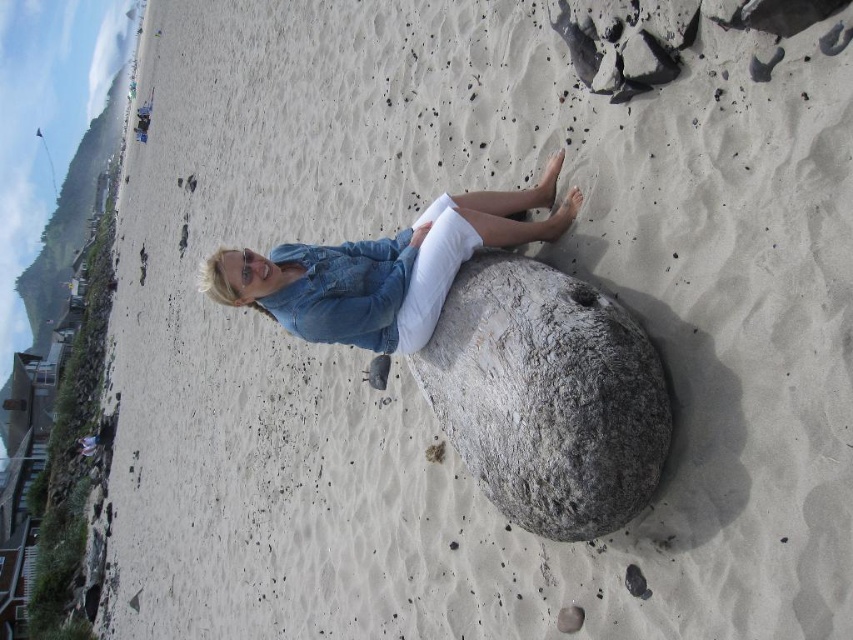
Between point (598, 429) and point (273, 301), which one is positioned in front?

Positioned in front is point (598, 429).

The height and width of the screenshot is (640, 853). In order to click on gray rough boulder at center in this screenshot , I will do `click(547, 396)`.

Which is behind, point (469, 470) or point (399, 339)?

Point (399, 339)

Identify the location of gray rough boulder at center. (547, 396).